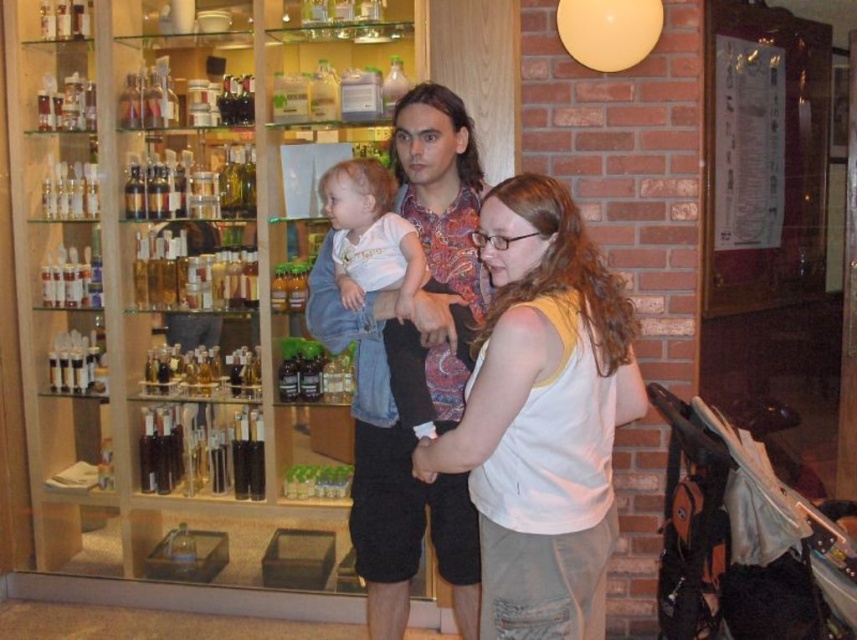
Question: Which object is positioned farthest from the white soft shirt at center?

Choices:
 (A) matte floral shirt at center
 (B) white cotton tank top at center

Answer: (B)

Question: Considering the real-world distances, which object is closest to the white soft shirt at center?

Choices:
 (A) matte floral shirt at center
 (B) white cotton tank top at center

Answer: (A)

Question: Does white cotton tank top at center appear under white soft shirt at center?

Choices:
 (A) no
 (B) yes

Answer: (B)

Question: In this image, where is matte floral shirt at center located relative to white soft shirt at center?

Choices:
 (A) right
 (B) left

Answer: (B)

Question: Which point appears closest to the camera in this image?

Choices:
 (A) (523, 445)
 (B) (414, 417)
 (C) (406, 256)

Answer: (A)

Question: Considering the relative positions of white cotton tank top at center and matte floral shirt at center in the image provided, where is white cotton tank top at center located with respect to matte floral shirt at center?

Choices:
 (A) right
 (B) left

Answer: (A)